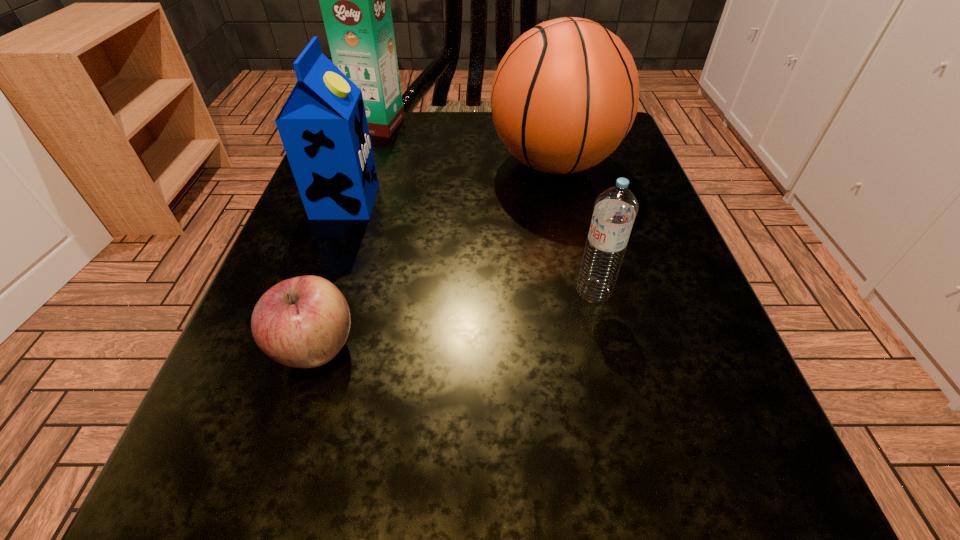
The image size is (960, 540). In order to click on vacant position in the image that satisfies the following two spatial constraints: 1. with the cap open on the nearer carton; 2. on the right side of the second shortest object in this screenshot , I will do coord(314,292).